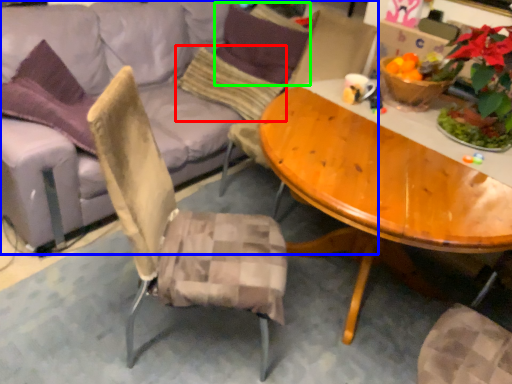
Question: Based on their relative distances, which object is nearer to pillow (highlighted by a red box)? Choose from studio couch (highlighted by a blue box) and pillow (highlighted by a green box).

Choices:
 (A) studio couch
 (B) pillow

Answer: (A)